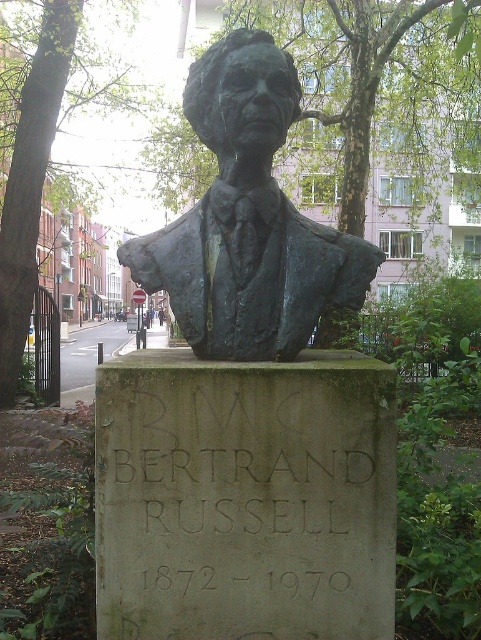
Question: Which point is closer to the camera taking this photo?

Choices:
 (A) (367, 566)
 (B) (152, 285)

Answer: (A)

Question: Is bronze statue at center positioned in front of graycarved stonebust at center?

Choices:
 (A) yes
 (B) no

Answer: (B)

Question: Can you confirm if bronze statue at center is positioned above graycarved stonebust at center?

Choices:
 (A) yes
 (B) no

Answer: (A)

Question: Among these objects, which one is farthest from the camera?

Choices:
 (A) graycarved stonebust at center
 (B) bronze statue at center

Answer: (B)

Question: Does bronze statue at center appear on the left side of graycarved stonebust at center?

Choices:
 (A) no
 (B) yes

Answer: (B)